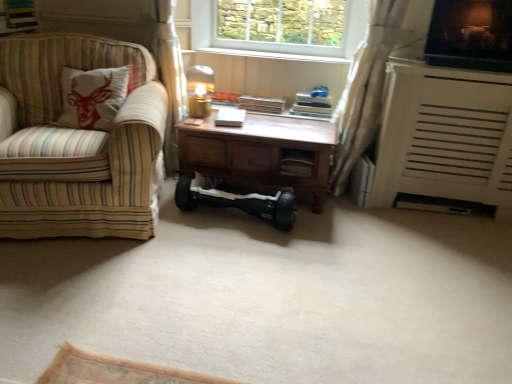
Question: Can you confirm if wooden desk at center is smaller than black rubber hoverboard at center?

Choices:
 (A) yes
 (B) no

Answer: (A)

Question: Considering the relative sizes of wooden desk at center and black rubber hoverboard at center in the image provided, is wooden desk at center thinner than black rubber hoverboard at center?

Choices:
 (A) no
 (B) yes

Answer: (B)

Question: Is wooden desk at center positioned beyond the bounds of black rubber hoverboard at center?

Choices:
 (A) no
 (B) yes

Answer: (B)

Question: Can you confirm if wooden desk at center is positioned to the right of black rubber hoverboard at center?

Choices:
 (A) yes
 (B) no

Answer: (B)

Question: Is the depth of wooden desk at center greater than that of black rubber hoverboard at center?

Choices:
 (A) yes
 (B) no

Answer: (A)

Question: In terms of size, does metallic gold table lamp at center appear bigger or smaller than wooden desk at center?

Choices:
 (A) big
 (B) small

Answer: (B)

Question: From a real-world perspective, is metallic gold table lamp at center physically located above or below wooden desk at center?

Choices:
 (A) below
 (B) above

Answer: (B)

Question: Looking at their shapes, would you say metallic gold table lamp at center is wider or thinner than wooden desk at center?

Choices:
 (A) wide
 (B) thin

Answer: (B)

Question: From the image's perspective, is metallic gold table lamp at center above or below wooden desk at center?

Choices:
 (A) below
 (B) above

Answer: (B)

Question: From a real-world perspective, relative to metallic gold table lamp at center, is wooden drawer at center vertically above or below?

Choices:
 (A) above
 (B) below

Answer: (B)

Question: Is point (285, 157) closer or farther from the camera than point (207, 67)?

Choices:
 (A) farther
 (B) closer

Answer: (B)

Question: Do you think wooden drawer at center is within metallic gold table lamp at center, or outside of it?

Choices:
 (A) inside
 (B) outside

Answer: (B)

Question: Considering the positions of wooden drawer at center and metallic gold table lamp at center in the image, is wooden drawer at center wider or thinner than metallic gold table lamp at center?

Choices:
 (A) thin
 (B) wide

Answer: (B)

Question: Looking at their shapes, would you say black rubber hoverboard at center is wider or thinner than white textured heater at right?

Choices:
 (A) thin
 (B) wide

Answer: (B)

Question: Is point (189, 274) positioned closer to the camera than point (502, 84)?

Choices:
 (A) farther
 (B) closer

Answer: (B)